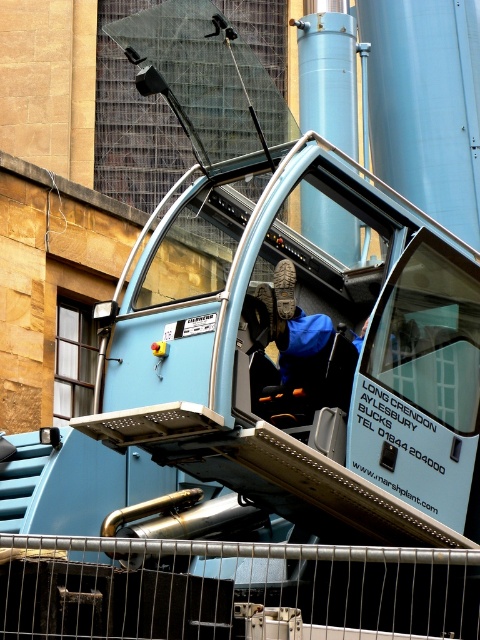
Question: Is metal at lower center below blue fabric jacket at center?

Choices:
 (A) no
 (B) yes

Answer: (B)

Question: Can you confirm if metal at lower center is smaller than blue fabric jacket at center?

Choices:
 (A) yes
 (B) no

Answer: (B)

Question: Is metal at lower center behind blue fabric jacket at center?

Choices:
 (A) no
 (B) yes

Answer: (A)

Question: Which point appears farthest from the camera in this image?

Choices:
 (A) (44, 563)
 (B) (280, 353)

Answer: (B)